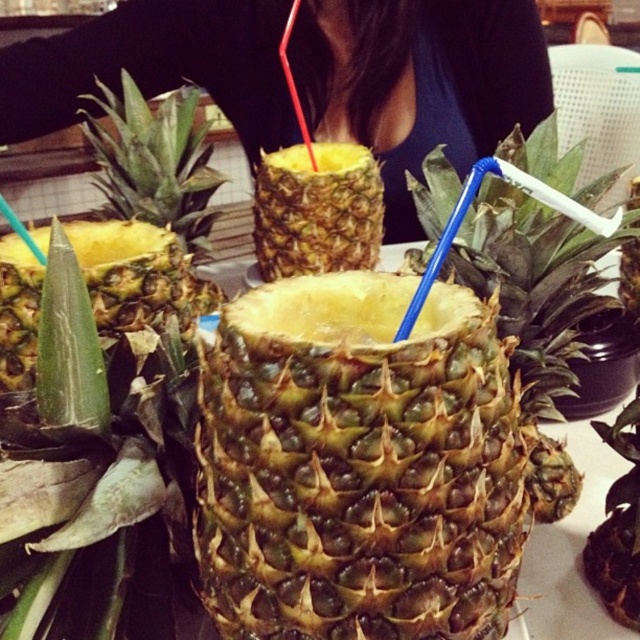
The image size is (640, 640). Describe the element at coordinates (419, 81) in the screenshot. I see `black fabric at center` at that location.

Which is behind, point (458, 44) or point (260, 244)?

Positioned behind is point (458, 44).

Who is more distant from viewer, (410, 220) or (282, 163)?

The point (410, 220) is more distant.

I want to click on black fabric at center, so click(x=419, y=81).

Which is behind, point (516, 433) or point (436, 141)?

The point (436, 141) is behind.

What do you see at coordinates (356, 465) in the screenshot?
I see `green textured pineapple at center` at bounding box center [356, 465].

The height and width of the screenshot is (640, 640). Identify the location of green textured pineapple at center. (356, 465).

Is green textured pineapple at center thinner than green rough pineapple at center?

In fact, green textured pineapple at center might be wider than green rough pineapple at center.

Is green textured pineapple at center positioned before green rough pineapple at center?

Yes, green textured pineapple at center is in front of green rough pineapple at center.

In order to click on green textured pineapple at center in this screenshot , I will do `click(356, 465)`.

You are a GUI agent. You are given a task and a screenshot of the screen. Output one action in this format:
    pyautogui.click(x=<x>, y=<y>)
    Task: Click on the green textured pineapple at center
    This screenshot has width=640, height=640.
    Given the screenshot: What is the action you would take?
    pyautogui.click(x=356, y=465)